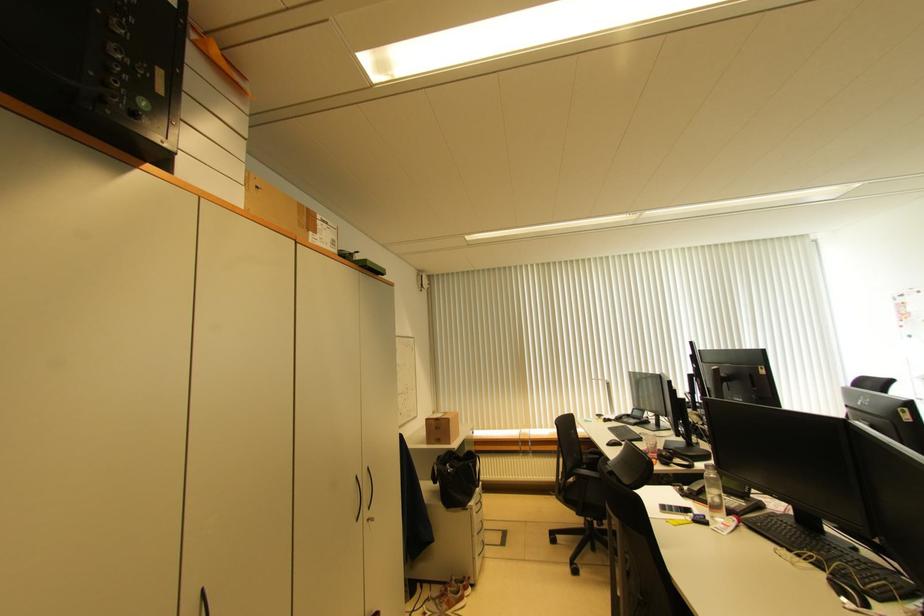
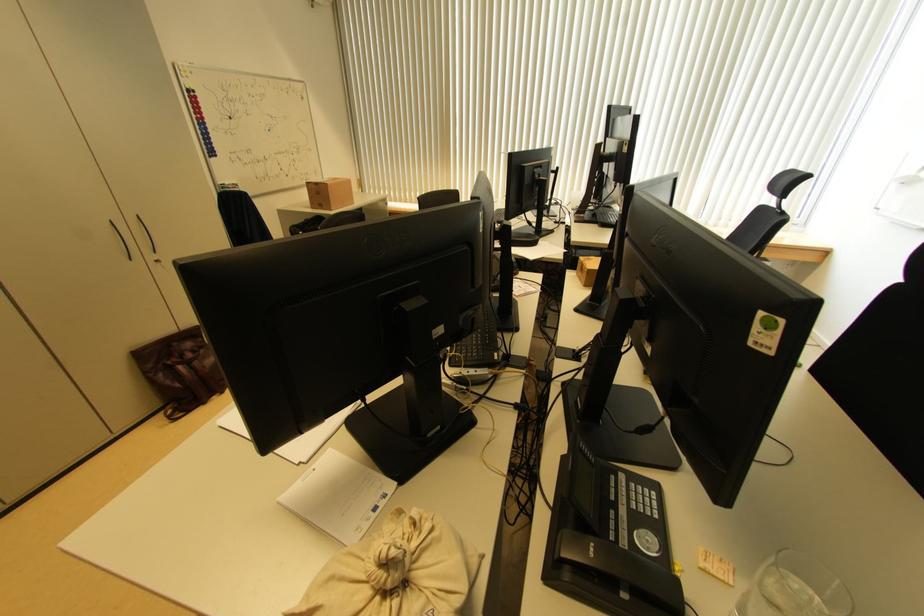
In the second image, find the point that corresponds to point (451, 422) in the first image.

(329, 188)